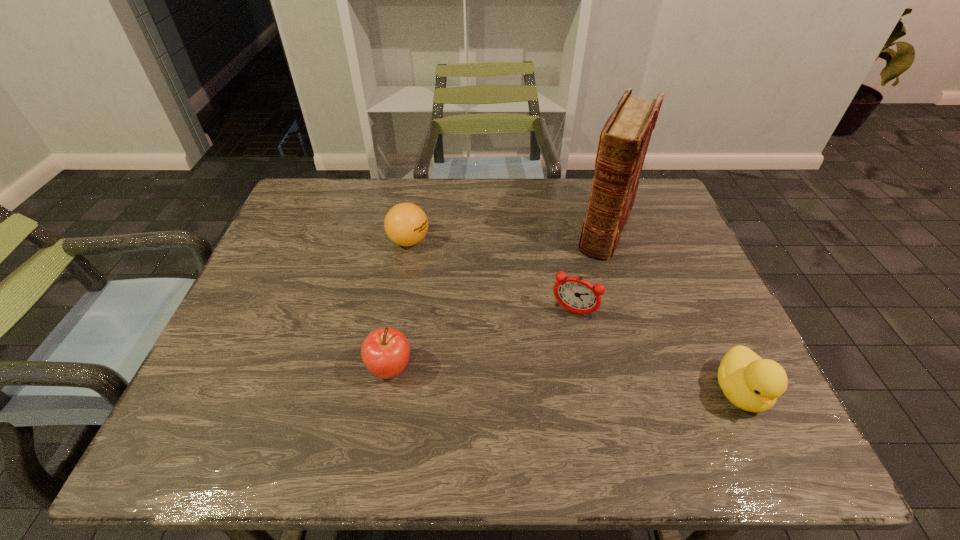
Find the location of a particular element. The width and height of the screenshot is (960, 540). object at the far right corner is located at coordinates (624, 139).

Find the location of a particular element. This screenshot has height=540, width=960. object located at the near right corner is located at coordinates (751, 383).

Find the location of a particular element. This screenshot has width=960, height=540. free region at the far edge is located at coordinates (470, 186).

Where is `free space at the near edge of the desktop`? This screenshot has width=960, height=540. free space at the near edge of the desktop is located at coordinates (538, 400).

You are a GUI agent. You are given a task and a screenshot of the screen. Output one action in this format:
    pyautogui.click(x=<x>, y=<y>)
    Task: Click on the vacant position at the left edge of the desktop
    Image resolution: width=960 pixels, height=540 pixels.
    Given the screenshot: What is the action you would take?
    pyautogui.click(x=279, y=321)

In the image, there is a desktop. What are the coordinates of `vacant area at the right edge` in the screenshot? It's located at (712, 359).

Where is `vacant point at the far left corner`? The height and width of the screenshot is (540, 960). vacant point at the far left corner is located at coordinates (306, 210).

Identify the location of free space at the far right corner of the desktop. (649, 205).

In the image, there is a desktop. Where is `vacant space at the near right corner`? vacant space at the near right corner is located at coordinates (712, 397).

Where is `blank region between the duck and the apple`? The height and width of the screenshot is (540, 960). blank region between the duck and the apple is located at coordinates (564, 380).